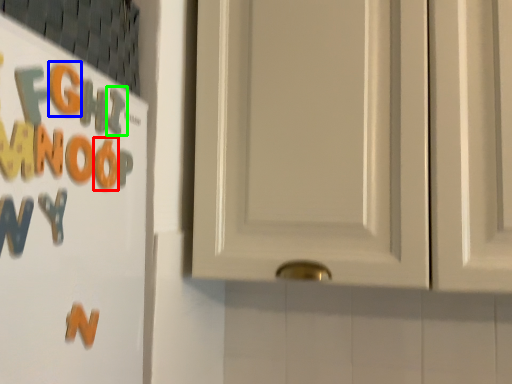
Question: Considering the real-world distances, which object is farthest from letter (highlighted by a red box)? letter (highlighted by a blue box) or letter (highlighted by a green box)?

Choices:
 (A) letter
 (B) letter

Answer: (A)